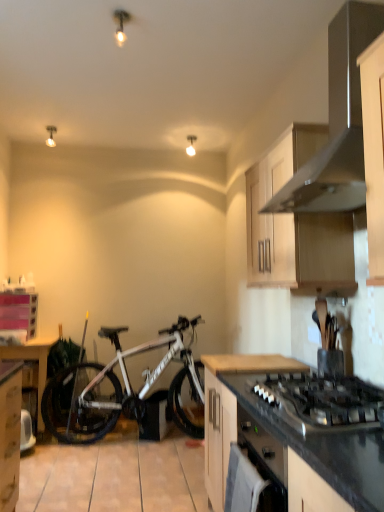
Image resolution: width=384 pixels, height=512 pixels. What do you see at coordinates (191, 145) in the screenshot? I see `matte white light fixture at upper center, the 2th light fixture when ordered from front to back` at bounding box center [191, 145].

Measure the distance between black granite countertop at lower right, positioned as the second countertop in top-to-bottom order, and camera.

black granite countertop at lower right, positioned as the second countertop in top-to-bottom order, is 34.45 inches away from camera.

Where is `satin silver range hood at upper right`? The height and width of the screenshot is (512, 384). satin silver range hood at upper right is located at coordinates (337, 122).

At what (x,y) coordinates should I click in order to perform the action: click on white metallic bicycle at lower left. Please return your answer as a coordinate pair (x, y). Image resolution: width=384 pixels, height=512 pixels. Looking at the image, I should click on (125, 389).

Image resolution: width=384 pixels, height=512 pixels. In order to click on wooden table at left in this screenshot , I will do `click(32, 359)`.

The image size is (384, 512). Find the location of `matte white light fixture at upper center, which ranks as the 1th light fixture in back-to-front order`. matte white light fixture at upper center, which ranks as the 1th light fixture in back-to-front order is located at coordinates (191, 145).

In the scene shown: Could you tell me if black granite countertop at lower right, positioned as the second countertop in top-to-bottom order, is facing black matte gas stove at lower right?

No, black granite countertop at lower right, positioned as the second countertop in top-to-bottom order, is not aimed at black matte gas stove at lower right.

Considering the positions of point (383, 472) and point (372, 423), is point (383, 472) closer or farther from the camera than point (372, 423)?

Point (383, 472) is closer to the camera than point (372, 423).

From a real-world perspective, does black granite countertop at lower right, which ranks as the 1th countertop in bottom-to-top order, stand above black matte gas stove at lower right?

Incorrect, from a real-world perspective, black granite countertop at lower right, which ranks as the 1th countertop in bottom-to-top order, is lower than black matte gas stove at lower right.

Where is `bicycle that is in front of the pink plastic container at left, the 2th cabinetry when ordered from right to left`? Image resolution: width=384 pixels, height=512 pixels. bicycle that is in front of the pink plastic container at left, the 2th cabinetry when ordered from right to left is located at coordinates (125, 389).

Considering the positions of point (105, 429) and point (5, 311), is point (105, 429) closer or farther from the camera than point (5, 311)?

Point (105, 429) appears to be closer to the viewer than point (5, 311).

Is white metallic bicycle at lower left inside the boundaries of pink plastic container at left, marked as the first cabinetry in a back-to-front arrangement, or outside?

white metallic bicycle at lower left is not enclosed by pink plastic container at left, marked as the first cabinetry in a back-to-front arrangement.

Is there a large distance between white metallic bicycle at lower left and pink plastic container at left, which is the 2th cabinetry in front-to-back order?

white metallic bicycle at lower left is positioned a significant distance from pink plastic container at left, which is the 2th cabinetry in front-to-back order.

From a real-world perspective, which is physically above, wooden at center, which appears as the 1th countertop when viewed from the top, or black matte gas stove at lower right?

In real-world perspective, black matte gas stove at lower right is above.

From the image's perspective, does wooden at center, which is counted as the second countertop, starting from the bottom, appear higher than black matte gas stove at lower right?

No, from the image's perspective, wooden at center, which is counted as the second countertop, starting from the bottom, is not above black matte gas stove at lower right.

Which object is further away from the camera, wooden at center, which appears as the 1th countertop when viewed from the top, or black matte gas stove at lower right?

wooden at center, which appears as the 1th countertop when viewed from the top, is behind.

From the picture: From a real-world perspective, is black matte gas stove at lower right over matte white light fixture at upper left, the second light fixture viewed from the back?

No, from a real-world perspective, black matte gas stove at lower right is not on top of matte white light fixture at upper left, the second light fixture viewed from the back.

Starting from the black matte gas stove at lower right, which light fixture is the 2nd one to the left? Please provide its 2D coordinates.

[(51, 135)]

Is black matte gas stove at lower right positioned behind matte white light fixture at upper left, the second light fixture from the right?

No, it is not.

Is wooden cabinet at upper right, the 1th cabinetry from the right, touching black granite countertop at lower right, positioned as the second countertop in top-to-bottom order?

No, wooden cabinet at upper right, the 1th cabinetry from the right, is not in contact with black granite countertop at lower right, positioned as the second countertop in top-to-bottom order.

Which object is further away from the camera taking this photo, wooden cabinet at upper right, acting as the first cabinetry starting from the top, or black granite countertop at lower right, which ranks as the 1th countertop in bottom-to-top order?

wooden cabinet at upper right, acting as the first cabinetry starting from the top, is further from the camera.

Is wooden cabinet at upper right, which is counted as the 2th cabinetry, starting from the back, inside or outside of black granite countertop at lower right, positioned as the second countertop in top-to-bottom order?

wooden cabinet at upper right, which is counted as the 2th cabinetry, starting from the back, is not enclosed by black granite countertop at lower right, positioned as the second countertop in top-to-bottom order.

In terms of width, does wooden cabinet at upper right, which is counted as the 2th cabinetry, starting from the back, look wider or thinner when compared to black granite countertop at lower right, positioned as the second countertop in top-to-bottom order?

In the image, wooden cabinet at upper right, which is counted as the 2th cabinetry, starting from the back, appears to be more narrow than black granite countertop at lower right, positioned as the second countertop in top-to-bottom order.

Does point (288, 147) lie behind point (243, 470)?

Yes, it is.

Which object is closer to the camera, wooden cabinet at upper right, which is counted as the 2th cabinetry, starting from the back, or black matte oven at lower center?

black matte oven at lower center is closer to the camera.

Could you tell me if wooden cabinet at upper right, acting as the first cabinetry starting from the top, is turned towards black matte oven at lower center?

No, wooden cabinet at upper right, acting as the first cabinetry starting from the top, is not aimed at black matte oven at lower center.

Does white metallic bicycle at lower left turn towards wooden table at left?

No, white metallic bicycle at lower left is not oriented towards wooden table at left.

Considering the sizes of objects white metallic bicycle at lower left and wooden table at left in the image provided, who is smaller, white metallic bicycle at lower left or wooden table at left?

wooden table at left.

Considering the positions of points (190, 376) and (20, 357), is point (190, 376) closer to camera compared to point (20, 357)?

No, it is not.

From a real-world perspective, between white metallic bicycle at lower left and wooden table at left, who is vertically lower?

In real-world perspective, wooden table at left is lower.

Where is `gas stove in front of the black granite countertop at lower right, positioned as the second countertop in top-to-bottom order`? The height and width of the screenshot is (512, 384). gas stove in front of the black granite countertop at lower right, positioned as the second countertop in top-to-bottom order is located at coordinates (321, 401).

In order to click on cabinetry located behind the white metallic bicycle at lower left in this screenshot , I will do `click(18, 312)`.

Considering their positions, is wooden at center, which appears as the 1th countertop when viewed from the top, positioned closer to black matte gas stove at lower right than black matte oven at lower center?

black matte oven at lower center.

Based on their spatial positions, is black matte oven at lower center or black matte gas stove at lower right closer to wooden table at left?

black matte oven at lower center.

Estimate the real-world distances between objects in this image. Which object is further from wooden cabinet at upper right, acting as the first cabinetry starting from the top, white metallic bicycle at lower left or matte white light fixture at upper left, which is counted as the first light fixture, starting from the left?

Among the two, matte white light fixture at upper left, which is counted as the first light fixture, starting from the left, is located further to wooden cabinet at upper right, acting as the first cabinetry starting from the top.

From the image, which object appears to be nearer to wooden at center, which appears as the 1th countertop when viewed from the top, white metallic bicycle at lower left or matte white light fixture at upper center, the 2th light fixture when ordered from front to back?

Based on the image, white metallic bicycle at lower left appears to be nearer to wooden at center, which appears as the 1th countertop when viewed from the top.

Based on their spatial positions, is wooden table at left or wooden cabinet at upper right, the 2th cabinetry in the left-to-right sequence, closer to black matte gas stove at lower right?

wooden cabinet at upper right, the 2th cabinetry in the left-to-right sequence, is positioned closer to the anchor black matte gas stove at lower right.

Consider the image. When comparing their distances from wooden cabinet at upper right, placed as the second cabinetry when sorted from bottom to top, does black matte gas stove at lower right or white metallic bicycle at lower left seem closer?

black matte gas stove at lower right is closer to wooden cabinet at upper right, placed as the second cabinetry when sorted from bottom to top.

Based on the photo, considering their positions, is matte white light fixture at upper left, the second light fixture from the right, positioned closer to wooden cabinet at upper right, the 2th cabinetry in the left-to-right sequence, than wooden table at left?

The object closer to wooden cabinet at upper right, the 2th cabinetry in the left-to-right sequence, is wooden table at left.

Which object lies further to the anchor point wooden table at left, matte white light fixture at upper center, which ranks as the 1th light fixture in back-to-front order, or black matte gas stove at lower right?

Based on the image, black matte gas stove at lower right appears to be further to wooden table at left.

Identify the location of kitchen appliance between black matte gas stove at lower right and wooden table at left along the z-axis. (337, 122).

What are the coordinates of `light fixture located between satin silver range hood at upper right and matte white light fixture at upper center, the 2th light fixture when ordered from front to back, in the depth direction` in the screenshot? It's located at (51, 135).

Identify the location of light fixture between black matte oven at lower center and matte white light fixture at upper center, the 2th light fixture when ordered from front to back, from front to back. (51, 135).

Find the location of a particular element. This screenshot has width=384, height=512. kitchen appliance between black matte gas stove at lower right and matte white light fixture at upper left, the second light fixture viewed from the back, in the front-back direction is located at coordinates (337, 122).